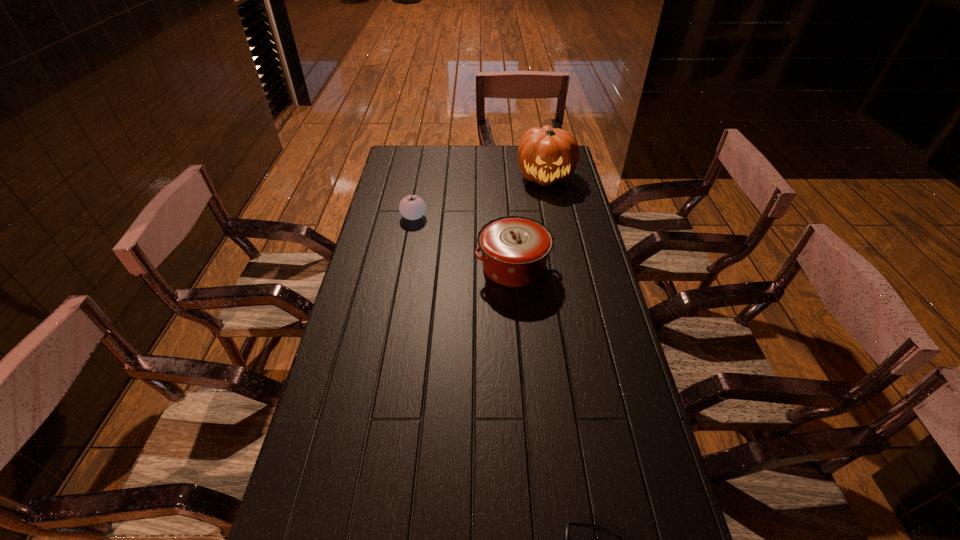
Locate an element on the screen. The image size is (960, 540). the farthest object is located at coordinates (546, 155).

Locate an element on the screen. the tallest object is located at coordinates (546, 155).

You are a GUI agent. You are given a task and a screenshot of the screen. Output one action in this format:
    pyautogui.click(x=<x>, y=<y>)
    Task: Click on the third farthest object
    
    Given the screenshot: What is the action you would take?
    (514, 249)

You are a GUI agent. You are given a task and a screenshot of the screen. Output one action in this format:
    pyautogui.click(x=<x>, y=<y>)
    Task: Click on the second tallest object
    Image resolution: width=960 pixels, height=540 pixels.
    Given the screenshot: What is the action you would take?
    pyautogui.click(x=514, y=249)

Locate an element on the screen. This screenshot has height=540, width=960. the third tallest object is located at coordinates (412, 207).

I want to click on the leftmost object, so click(x=412, y=207).

Image resolution: width=960 pixels, height=540 pixels. I want to click on free space located 0.220m on the carved face of the pumpkin, so click(556, 227).

Locate an element on the screen. vacant point located 0.070m on the right of the casserole is located at coordinates (573, 267).

The width and height of the screenshot is (960, 540). What are the coordinates of `vacant space located on the back of the tomato` in the screenshot? It's located at (418, 194).

Where is `object at the far edge`? object at the far edge is located at coordinates (546, 155).